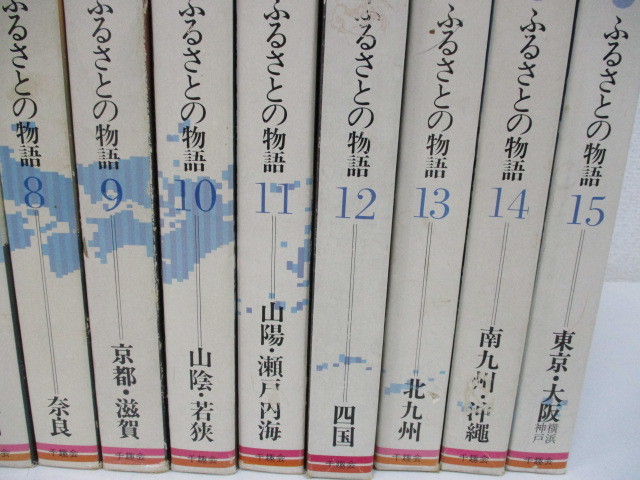
The image size is (640, 480). I want to click on series of books, so click(116, 322), click(356, 318), click(513, 319).